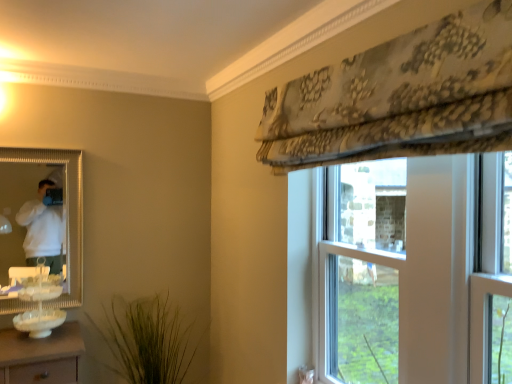
Question: From a real-world perspective, is gold-framed mirror at left beneath clear glass window at center?

Choices:
 (A) no
 (B) yes

Answer: (A)

Question: From a real-world perspective, is gold-framed mirror at left positioned over clear glass window at center based on gravity?

Choices:
 (A) no
 (B) yes

Answer: (B)

Question: Does gold-framed mirror at left have a lesser width compared to clear glass window at center?

Choices:
 (A) no
 (B) yes

Answer: (A)

Question: Is gold-framed mirror at left positioned beyond the bounds of clear glass window at center?

Choices:
 (A) no
 (B) yes

Answer: (B)

Question: From the image's perspective, does gold-framed mirror at left appear lower than clear glass window at center?

Choices:
 (A) yes
 (B) no

Answer: (B)

Question: Considering the positions of gold-framed mirror at left and green grass-like plant at lower center in the image, is gold-framed mirror at left taller or shorter than green grass-like plant at lower center?

Choices:
 (A) short
 (B) tall

Answer: (B)

Question: In terms of size, does gold-framed mirror at left appear bigger or smaller than green grass-like plant at lower center?

Choices:
 (A) small
 (B) big

Answer: (A)

Question: Is gold-framed mirror at left to the left or to the right of green grass-like plant at lower center in the image?

Choices:
 (A) right
 (B) left

Answer: (B)

Question: Looking at their shapes, would you say gold-framed mirror at left is wider or thinner than green grass-like plant at lower center?

Choices:
 (A) wide
 (B) thin

Answer: (B)

Question: Is clear glass window at center bigger or smaller than green grass-like plant at lower center?

Choices:
 (A) small
 (B) big

Answer: (A)

Question: Looking at their shapes, would you say clear glass window at center is wider or thinner than green grass-like plant at lower center?

Choices:
 (A) thin
 (B) wide

Answer: (A)

Question: Considering their positions, is clear glass window at center located in front of or behind green grass-like plant at lower center?

Choices:
 (A) behind
 (B) front

Answer: (B)

Question: Choose the correct answer: Is clear glass window at center inside green grass-like plant at lower center or outside it?

Choices:
 (A) outside
 (B) inside

Answer: (A)

Question: From the image's perspective, relative to white glassware at lower left, is clear glass window at center above or below?

Choices:
 (A) below
 (B) above

Answer: (B)

Question: Which is correct: clear glass window at center is inside white glassware at lower left, or outside of it?

Choices:
 (A) outside
 (B) inside

Answer: (A)